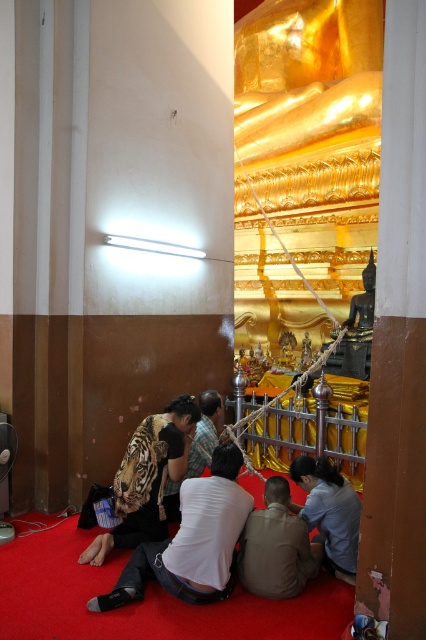
Question: Among these points, which one is farthest from the camera?

Choices:
 (A) (206, 573)
 (B) (258, 576)
 (C) (321, 477)
 (D) (164, 440)

Answer: (D)

Question: Can you confirm if striped fur tiger at lower left is positioned above light blue shirt at lower right?

Choices:
 (A) yes
 (B) no

Answer: (A)

Question: Is striped fur tiger at lower left to the right of brown matte shirt at lower center from the viewer's perspective?

Choices:
 (A) yes
 (B) no

Answer: (B)

Question: Is striped fur tiger at lower left below brown matte shirt at lower center?

Choices:
 (A) yes
 (B) no

Answer: (B)

Question: Based on their relative distances, which object is farther from the printed tiger-patterned shirt at lower left?

Choices:
 (A) striped fur tiger at lower left
 (B) brown matte shirt at lower center
 (C) light blue shirt at lower right

Answer: (C)

Question: Which point appears farthest from the camera in this image?

Choices:
 (A) (305, 547)
 (B) (143, 483)

Answer: (B)